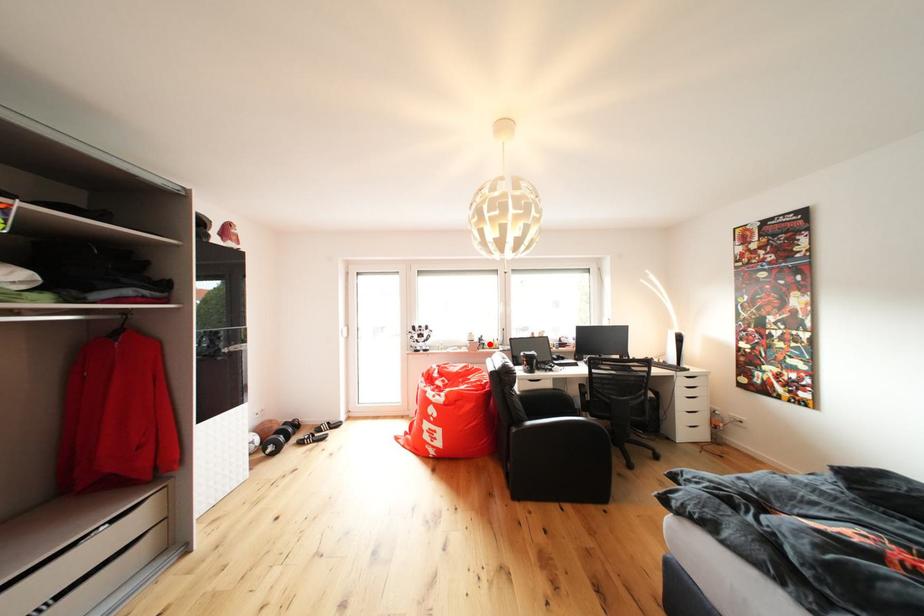
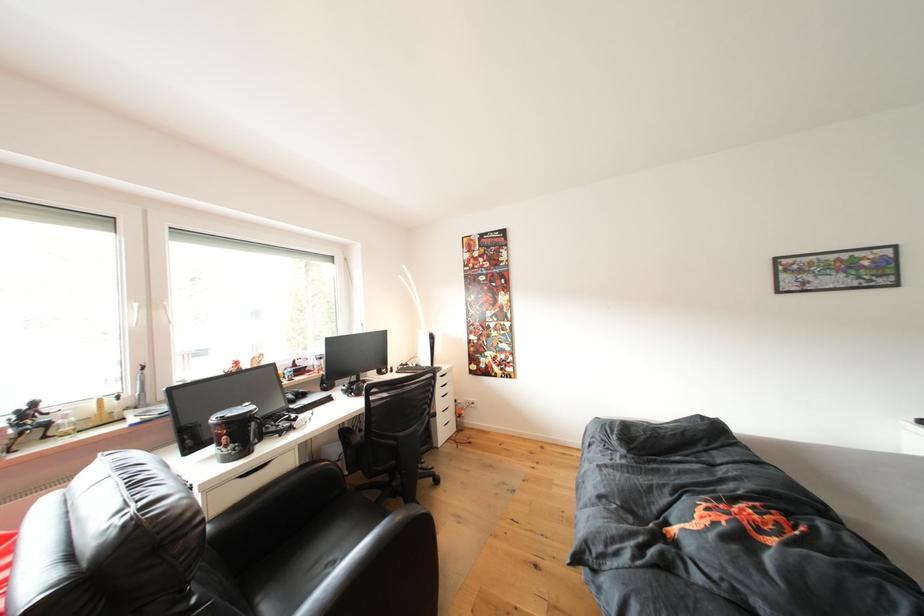
In the second image, find the point that corresponds to the highlighted location in the first image.

(35, 419)